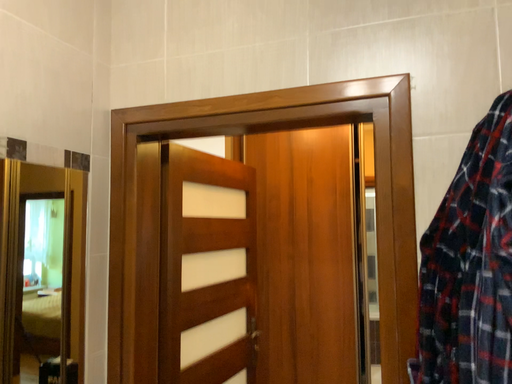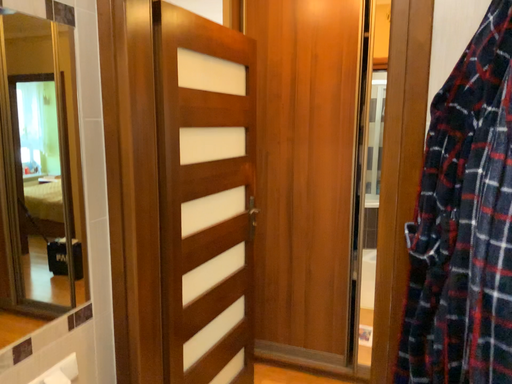
Question: How did the camera likely rotate when shooting the video?

Choices:
 (A) rotated upward
 (B) rotated downward

Answer: (B)